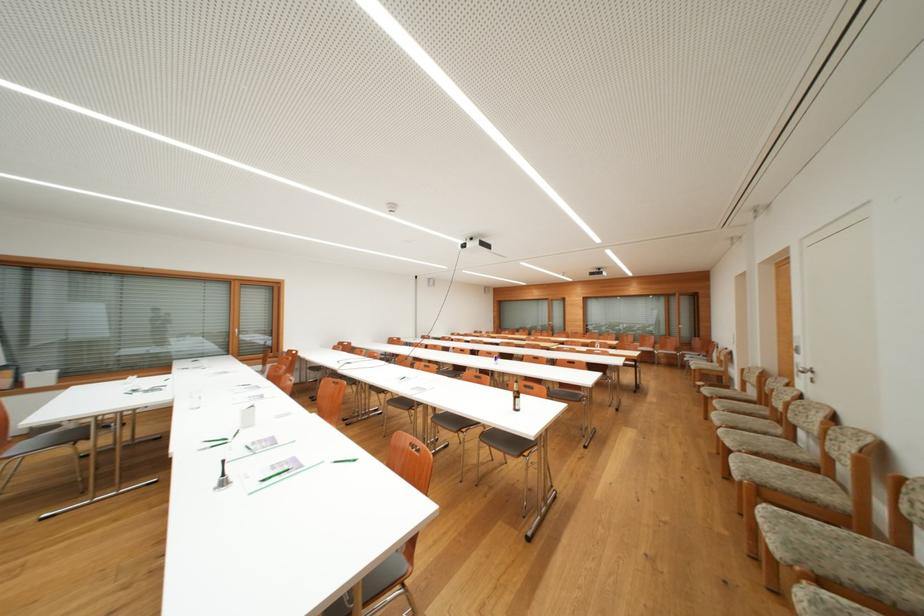
Where is `silver desk bell`? The image size is (924, 616). silver desk bell is located at coordinates (223, 477).